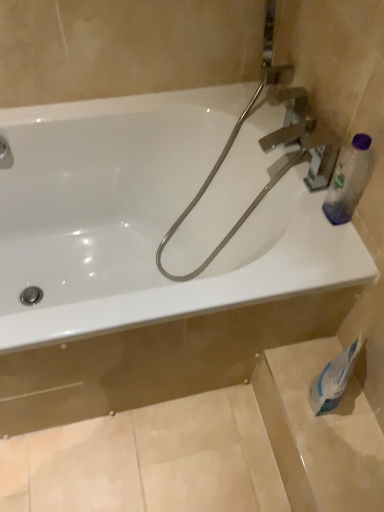
The image size is (384, 512). What are the coordinates of `vacant space in front of transparent plastic bottle at upper right` in the screenshot? It's located at (328, 252).